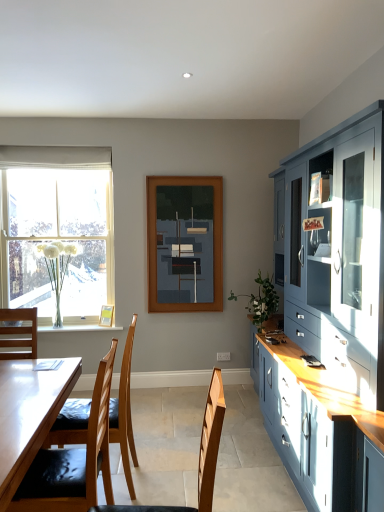
Question: Is white sheer curtain at upper left positioned far away from clear glass vase at lower left?

Choices:
 (A) no
 (B) yes

Answer: (B)

Question: Is the position of white sheer curtain at upper left less distant than that of clear glass vase at lower left?

Choices:
 (A) no
 (B) yes

Answer: (B)

Question: Is white sheer curtain at upper left oriented towards clear glass vase at lower left?

Choices:
 (A) yes
 (B) no

Answer: (B)

Question: Does white sheer curtain at upper left have a greater width compared to clear glass vase at lower left?

Choices:
 (A) no
 (B) yes

Answer: (A)

Question: Considering the relative sizes of white sheer curtain at upper left and clear glass vase at lower left in the image provided, is white sheer curtain at upper left thinner than clear glass vase at lower left?

Choices:
 (A) no
 (B) yes

Answer: (B)

Question: Is clear glass vase at left situated inside light brown wooden chair at left, the third chair in the front-to-back sequence, or outside?

Choices:
 (A) inside
 (B) outside

Answer: (B)

Question: In the image, is clear glass vase at left positioned in front of or behind light brown wooden chair at left, the third chair in the front-to-back sequence?

Choices:
 (A) front
 (B) behind

Answer: (B)

Question: From a real-world perspective, relative to light brown wooden chair at left, which is the first chair in back-to-front order, is clear glass vase at left vertically above or below?

Choices:
 (A) above
 (B) below

Answer: (A)

Question: In terms of size, does clear glass vase at left appear bigger or smaller than light brown wooden chair at left, the third chair in the front-to-back sequence?

Choices:
 (A) small
 (B) big

Answer: (B)

Question: In the image, is clear glass vase at left positioned in front of or behind white glass vase at left, which is the 1th plant from left to right?

Choices:
 (A) behind
 (B) front

Answer: (A)

Question: From a real-world perspective, is clear glass vase at left positioned above or below white glass vase at left, which is the second plant from right to left?

Choices:
 (A) above
 (B) below

Answer: (A)

Question: In terms of height, does clear glass vase at left look taller or shorter compared to white glass vase at left, the 2th plant when ordered from front to back?

Choices:
 (A) short
 (B) tall

Answer: (B)

Question: From the image's perspective, is clear glass vase at left above or below white glass vase at left, which is the 1th plant from left to right?

Choices:
 (A) below
 (B) above

Answer: (B)

Question: From a real-world perspective, is clear glass vase at lower left positioned above or below matte yellow picture frame at window?

Choices:
 (A) below
 (B) above

Answer: (A)

Question: Considering the positions of clear glass vase at lower left and matte yellow picture frame at window in the image, is clear glass vase at lower left wider or thinner than matte yellow picture frame at window?

Choices:
 (A) wide
 (B) thin

Answer: (A)